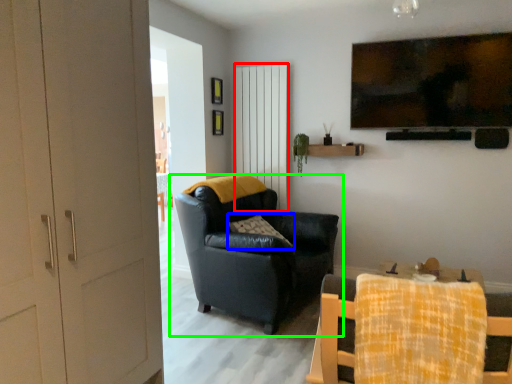
Question: Which object is positioned farthest from curtain (highlighted by a red box)? Select from pillow (highlighted by a blue box) and chair (highlighted by a green box).

Choices:
 (A) pillow
 (B) chair

Answer: (A)